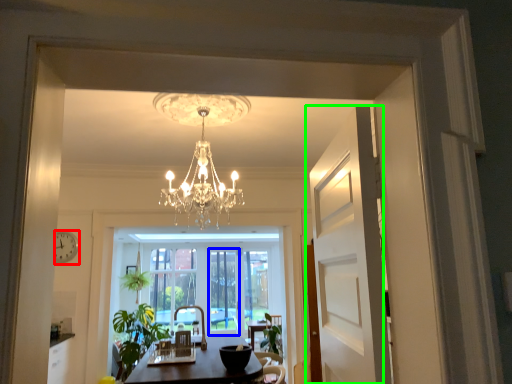
Question: Estimate the real-world distances between objects in this image. Which object is closer to clock (highlighted by a red box), window screen (highlighted by a blue box) or door (highlighted by a green box)?

Choices:
 (A) window screen
 (B) door

Answer: (A)